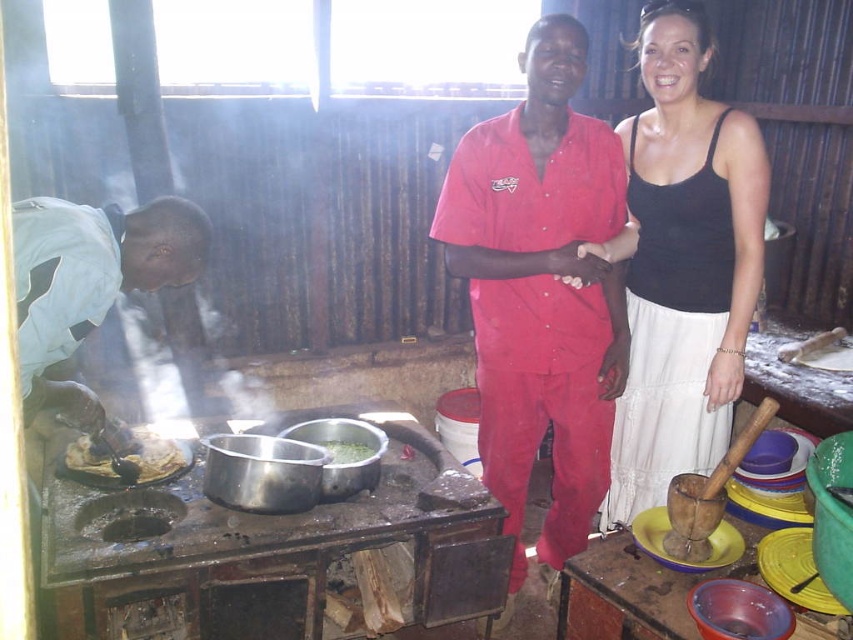
You are a chef in this rustic kitchen and need to determine if your matte red shirt at center can cover the brown matte food at lower left completely. Based on their sizes, is this possible?

The matte red shirt at center is wider than the brown matte food at lower left, so it can cover the brown matte food at lower left completely.

You are standing in the rustic kitchen and want to reach both points. Which point, point (x=660, y=486) or point (x=152, y=433), will you reach first if you move straight towards them?

You will reach point (x=660, y=486) first because it is closer to you than point (x=152, y=433).